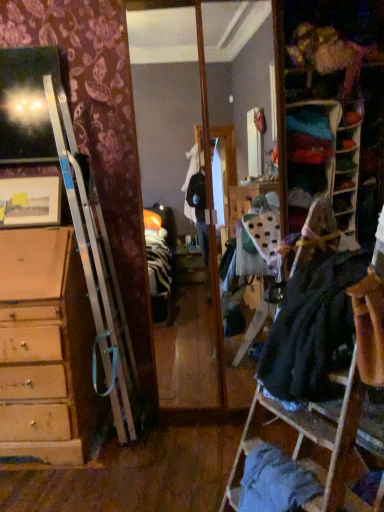
Describe the element at coordinates (30, 201) in the screenshot. Image resolution: width=384 pixels, height=512 pixels. I see `matte wooden picture frame at upper left` at that location.

Image resolution: width=384 pixels, height=512 pixels. Identify the location of matte wooden picture frame at upper left. (30, 201).

Describe the element at coordinates (312, 331) in the screenshot. I see `dark gray fabric dress at right, positioned as the second clothing in bottom-to-top order` at that location.

Where is `velvet fabric bookshelf at upper right`? Image resolution: width=384 pixels, height=512 pixels. velvet fabric bookshelf at upper right is located at coordinates coord(347,167).

Considering the relative positions of blue cotton shirt at lower right, the first clothing from the bottom, and dark gray fabric dress at right, positioned as the second clothing in bottom-to-top order, in the image provided, is blue cotton shirt at lower right, the first clothing from the bottom, to the left of dark gray fabric dress at right, positioned as the second clothing in bottom-to-top order, from the viewer's perspective?

Correct, you'll find blue cotton shirt at lower right, the first clothing from the bottom, to the left of dark gray fabric dress at right, positioned as the second clothing in bottom-to-top order.

Could you tell me if blue cotton shirt at lower right, marked as the second clothing in a top-to-bottom arrangement, is facing dark gray fabric dress at right, positioned as the second clothing in bottom-to-top order?

No, blue cotton shirt at lower right, marked as the second clothing in a top-to-bottom arrangement, is not turned towards dark gray fabric dress at right, positioned as the second clothing in bottom-to-top order.

Is blue cotton shirt at lower right, the first clothing from the bottom, spatially inside dark gray fabric dress at right, acting as the first clothing starting from the top, or outside of it?

The correct answer is: outside.

Is point (30, 181) farther from camera compared to point (268, 496)?

Yes, it is.

Which of these two, matte wooden picture frame at upper left or blue cotton shirt at lower right, the first clothing from the bottom, is smaller?

blue cotton shirt at lower right, the first clothing from the bottom, is smaller.

From the matte wooden picture frame at upper left, count 1st clothing to the right and point to it. Please provide its 2D coordinates.

[(275, 482)]

Is matte wooden picture frame at upper left in front of or behind blue cotton shirt at lower right, marked as the second clothing in a top-to-bottom arrangement, in the image?

Clearly, matte wooden picture frame at upper left is behind blue cotton shirt at lower right, marked as the second clothing in a top-to-bottom arrangement.

Is dark gray fabric dress at right, acting as the first clothing starting from the top, aimed at velvet fabric bookshelf at upper right?

No.

What's the angular difference between dark gray fabric dress at right, acting as the first clothing starting from the top, and velvet fabric bookshelf at upper right's facing directions?

They differ by 65.7 degrees in their facing directions.

From the picture: From the image's perspective, is dark gray fabric dress at right, acting as the first clothing starting from the top, located beneath velvet fabric bookshelf at upper right?

Yes, from the image's perspective, dark gray fabric dress at right, acting as the first clothing starting from the top, is beneath velvet fabric bookshelf at upper right.

Who is bigger, dark gray fabric dress at right, acting as the first clothing starting from the top, or velvet fabric bookshelf at upper right?

dark gray fabric dress at right, acting as the first clothing starting from the top, is bigger.

Which of these two, dark gray fabric dress at right, positioned as the second clothing in bottom-to-top order, or matte wooden picture frame at upper left, stands shorter?

matte wooden picture frame at upper left is shorter.

Is dark gray fabric dress at right, acting as the first clothing starting from the top, inside or outside of matte wooden picture frame at upper left?

dark gray fabric dress at right, acting as the first clothing starting from the top, lies outside matte wooden picture frame at upper left.

Is point (301, 404) positioned before point (17, 204)?

Yes, point (301, 404) is in front of point (17, 204).

Which point is more distant from viewer, (352, 147) or (33, 181)?

The point (33, 181) is farther.

Between velvet fabric bookshelf at upper right and matte wooden picture frame at upper left, which one has smaller size?

velvet fabric bookshelf at upper right is smaller.

What's the angular difference between velvet fabric bookshelf at upper right and matte wooden picture frame at upper left's facing directions?

4.75 degrees separate the facing orientations of velvet fabric bookshelf at upper right and matte wooden picture frame at upper left.

From a real-world perspective, relative to blue cotton shirt at lower right, the first clothing from the bottom, is dark gray fabric dress at right, positioned as the second clothing in bottom-to-top order, vertically above or below?

Clearly, from a real-world perspective, dark gray fabric dress at right, positioned as the second clothing in bottom-to-top order, is above blue cotton shirt at lower right, the first clothing from the bottom.

Is dark gray fabric dress at right, acting as the first clothing starting from the top, thinner than blue cotton shirt at lower right, marked as the second clothing in a top-to-bottom arrangement?

In fact, dark gray fabric dress at right, acting as the first clothing starting from the top, might be wider than blue cotton shirt at lower right, marked as the second clothing in a top-to-bottom arrangement.

Is dark gray fabric dress at right, positioned as the second clothing in bottom-to-top order, not within blue cotton shirt at lower right, the first clothing from the bottom?

Yes, dark gray fabric dress at right, positioned as the second clothing in bottom-to-top order, is not within blue cotton shirt at lower right, the first clothing from the bottom.

Identify the location of clothing on the left of dark gray fabric dress at right, acting as the first clothing starting from the top. The height and width of the screenshot is (512, 384). (275, 482).

Is matte wooden picture frame at upper left aimed at dark gray fabric dress at right, acting as the first clothing starting from the top?

No, matte wooden picture frame at upper left is not aimed at dark gray fabric dress at right, acting as the first clothing starting from the top.

Which point is more forward, (45, 192) or (326, 319)?

Positioned in front is point (326, 319).

Is matte wooden picture frame at upper left wider or thinner than dark gray fabric dress at right, positioned as the second clothing in bottom-to-top order?

matte wooden picture frame at upper left is thinner than dark gray fabric dress at right, positioned as the second clothing in bottom-to-top order.

You are a GUI agent. You are given a task and a screenshot of the screen. Output one action in this format:
    pyautogui.click(x=<x>, y=<y>)
    Task: Click on the clothing below the dark gray fabric dress at right, acting as the first clothing starting from the top (from a real-world perspective)
    The height and width of the screenshot is (512, 384).
    Given the screenshot: What is the action you would take?
    pyautogui.click(x=275, y=482)

In order to click on clothing that is the 1st one when counting rightward from the matte wooden picture frame at upper left in this screenshot , I will do `click(275, 482)`.

Estimate the real-world distances between objects in this image. Which object is further from blue cotton shirt at lower right, the first clothing from the bottom, dark gray fabric dress at right, acting as the first clothing starting from the top, or matte wooden picture frame at upper left?

matte wooden picture frame at upper left lies further to blue cotton shirt at lower right, the first clothing from the bottom, than the other object.

Estimate the real-world distances between objects in this image. Which object is closer to dark gray fabric dress at right, positioned as the second clothing in bottom-to-top order, matte wooden picture frame at upper left or blue cotton shirt at lower right, marked as the second clothing in a top-to-bottom arrangement?

Based on the image, blue cotton shirt at lower right, marked as the second clothing in a top-to-bottom arrangement, appears to be nearer to dark gray fabric dress at right, positioned as the second clothing in bottom-to-top order.

Considering their positions, is blue cotton shirt at lower right, the first clothing from the bottom, positioned further to matte wooden picture frame at upper left than velvet fabric bookshelf at upper right?

blue cotton shirt at lower right, the first clothing from the bottom, is further to matte wooden picture frame at upper left.

Estimate the real-world distances between objects in this image. Which object is further from matte wooden picture frame at upper left, dark gray fabric dress at right, acting as the first clothing starting from the top, or blue cotton shirt at lower right, marked as the second clothing in a top-to-bottom arrangement?

blue cotton shirt at lower right, marked as the second clothing in a top-to-bottom arrangement.

Estimate the real-world distances between objects in this image. Which object is further from dark gray fabric dress at right, positioned as the second clothing in bottom-to-top order, blue cotton shirt at lower right, the first clothing from the bottom, or matte wooden picture frame at upper left?

matte wooden picture frame at upper left is further to dark gray fabric dress at right, positioned as the second clothing in bottom-to-top order.

Consider the image. Estimate the real-world distances between objects in this image. Which object is closer to velvet fabric bookshelf at upper right, dark gray fabric dress at right, acting as the first clothing starting from the top, or matte wooden picture frame at upper left?

Among the two, dark gray fabric dress at right, acting as the first clothing starting from the top, is located nearer to velvet fabric bookshelf at upper right.

Based on their spatial positions, is dark gray fabric dress at right, positioned as the second clothing in bottom-to-top order, or blue cotton shirt at lower right, the first clothing from the bottom, further from velvet fabric bookshelf at upper right?

Based on the image, blue cotton shirt at lower right, the first clothing from the bottom, appears to be further to velvet fabric bookshelf at upper right.

Looking at the image, which one is located closer to velvet fabric bookshelf at upper right, blue cotton shirt at lower right, the first clothing from the bottom, or matte wooden picture frame at upper left?

blue cotton shirt at lower right, the first clothing from the bottom.

Where is `clothing situated between matte wooden picture frame at upper left and dark gray fabric dress at right, positioned as the second clothing in bottom-to-top order, from left to right`? This screenshot has width=384, height=512. clothing situated between matte wooden picture frame at upper left and dark gray fabric dress at right, positioned as the second clothing in bottom-to-top order, from left to right is located at coordinates [275, 482].

You are a GUI agent. You are given a task and a screenshot of the screen. Output one action in this format:
    pyautogui.click(x=<x>, y=<y>)
    Task: Click on the clothing between velvet fabric bookshelf at upper right and blue cotton shirt at lower right, the first clothing from the bottom, in the up-down direction
    Image resolution: width=384 pixels, height=512 pixels.
    Given the screenshot: What is the action you would take?
    pyautogui.click(x=312, y=331)